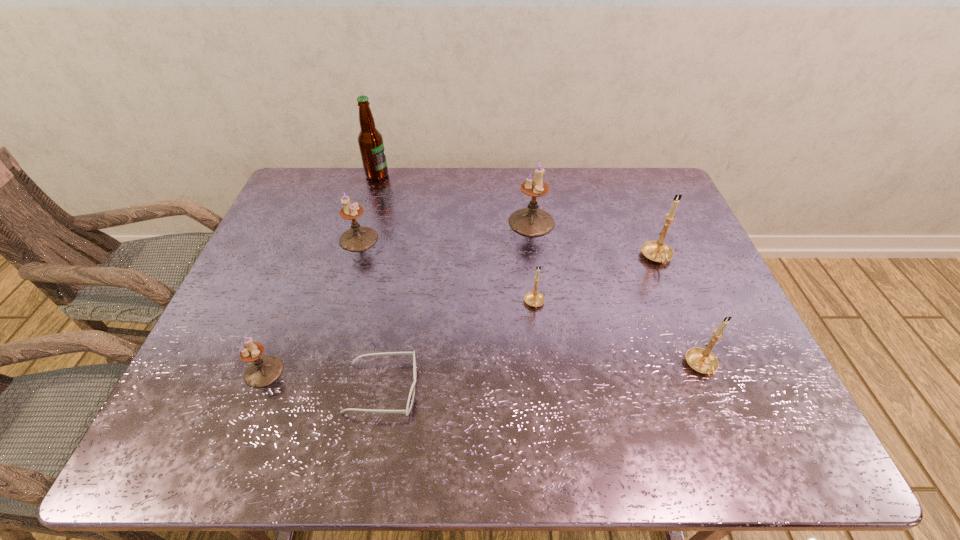
Where is `empty space that is in between the biggest gold candle holder and the second purple candle holder from left to right`? This screenshot has height=540, width=960. empty space that is in between the biggest gold candle holder and the second purple candle holder from left to right is located at coordinates (508, 248).

You are a GUI agent. You are given a task and a screenshot of the screen. Output one action in this format:
    pyautogui.click(x=<x>, y=<y>)
    Task: Click on the vacant area that lies between the farthest gold candle holder and the smallest purple candle holder
    The width and height of the screenshot is (960, 540).
    Given the screenshot: What is the action you would take?
    pyautogui.click(x=461, y=315)

The image size is (960, 540). What are the coordinates of `free space between the nearest gold candle holder and the farthest gold candle holder` in the screenshot? It's located at (679, 313).

The image size is (960, 540). What are the coordinates of `unoccupied position between the nearest gold candle holder and the farthest gold candle holder` in the screenshot? It's located at (679, 313).

What are the coordinates of `empty space between the nearest gold candle holder and the black sunglasses` in the screenshot? It's located at (541, 377).

Where is `empty space that is in between the second biggest purple candle holder and the black sunglasses`? The image size is (960, 540). empty space that is in between the second biggest purple candle holder and the black sunglasses is located at coordinates (371, 314).

This screenshot has height=540, width=960. In order to click on empty space that is in between the sunglasses and the farthest gold candle holder in this screenshot , I will do `click(519, 323)`.

The width and height of the screenshot is (960, 540). I want to click on blank region between the farthest gold candle holder and the sunglasses, so click(x=519, y=323).

Identify which object is the sixth nearest to the fourth farthest candle holder. Please provide its 2D coordinates. Your answer should be formatted as a tuple, i.e. [(x, y)], where the tuple contains the x and y coordinates of a point satisfying the conditions above.

[(263, 371)]

You are a GUI agent. You are given a task and a screenshot of the screen. Output one action in this format:
    pyautogui.click(x=<x>, y=<y>)
    Task: Click on the object that is the fifth closest to the brown beer bottle
    This screenshot has width=960, height=540.
    Given the screenshot: What is the action you would take?
    pyautogui.click(x=412, y=391)